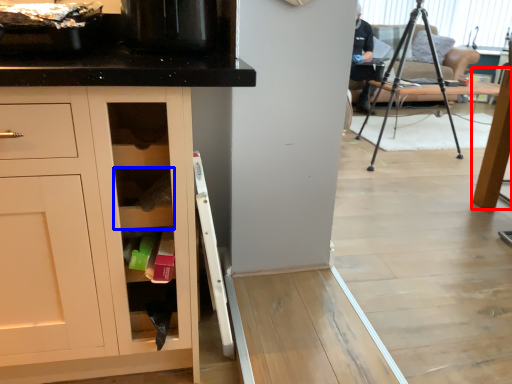
Question: Which point is closer to the camera, table (highlighted by a red box) or shelf (highlighted by a blue box)?

Choices:
 (A) table
 (B) shelf

Answer: (B)